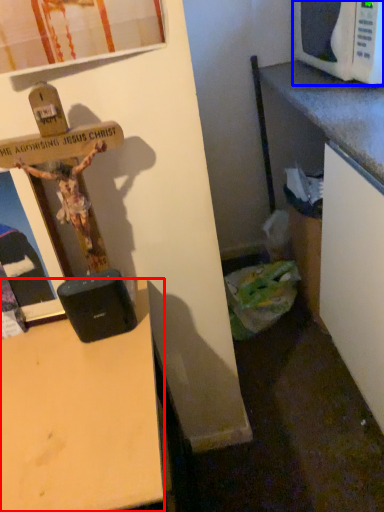
Question: Among these objects, which one is nearest to the camera, desk (highlighted by a red box) or microwave oven (highlighted by a blue box)?

Choices:
 (A) desk
 (B) microwave oven

Answer: (A)